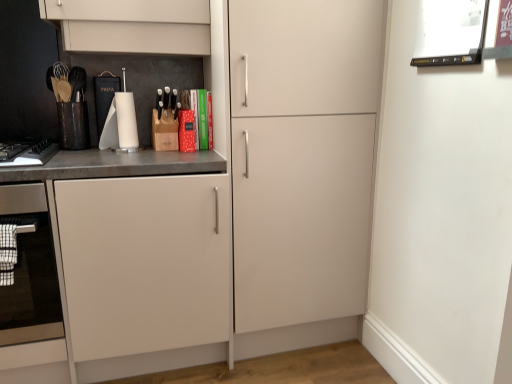
Question: Is point (475, 16) positioned closer to the camera than point (44, 160)?

Choices:
 (A) closer
 (B) farther

Answer: (A)

Question: Is white glossy picture frame at upper right, the 2th appliance when ordered from left to right, bigger or smaller than black matte keyboard at left?

Choices:
 (A) big
 (B) small

Answer: (B)

Question: Which of these objects is positioned closest to the stainless steel oven at left?

Choices:
 (A) black matte keyboard at left
 (B) matte white cabinet at center
 (C) white glossy paper towel holder at center, which ranks as the first appliance in left-to-right order
 (D) white glossy picture frame at upper right, positioned as the 2th appliance in back-to-front order

Answer: (B)

Question: Considering the real-world distances, which object is farthest from the white glossy picture frame at upper right, positioned as the 2th appliance in back-to-front order?

Choices:
 (A) stainless steel oven at left
 (B) black matte keyboard at left
 (C) white glossy paper towel holder at center, which ranks as the first appliance in left-to-right order
 (D) matte white cabinet at center

Answer: (A)